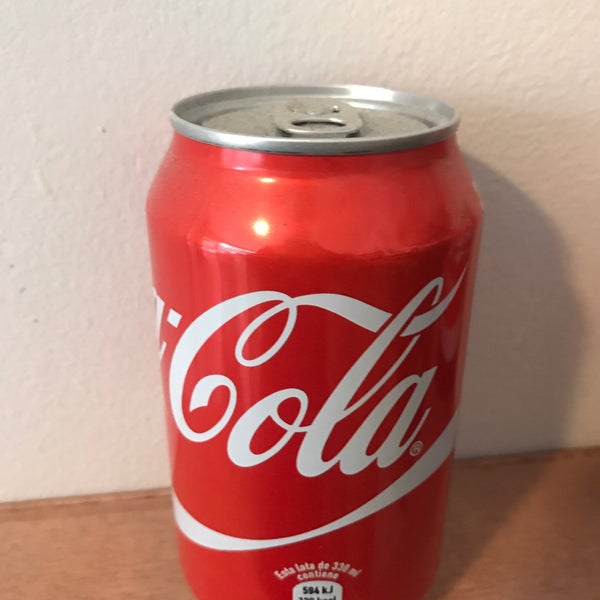
The image size is (600, 600). I want to click on reflection of the light sources, so click(261, 231), click(268, 180), click(238, 167), click(225, 245).